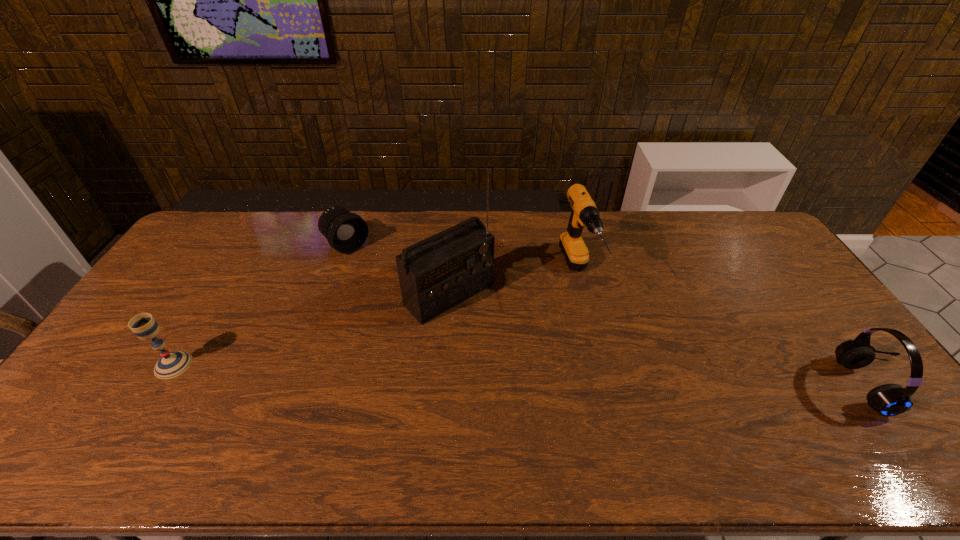
Where is `object located in the near edge section of the desktop`? This screenshot has height=540, width=960. object located in the near edge section of the desktop is located at coordinates (888, 400).

I want to click on object that is at the right edge, so click(x=888, y=400).

Where is `object present at the near right corner`? The height and width of the screenshot is (540, 960). object present at the near right corner is located at coordinates (888, 400).

Where is `free space at the far edge of the desktop`? Image resolution: width=960 pixels, height=540 pixels. free space at the far edge of the desktop is located at coordinates (516, 211).

Where is `vacant space at the near edge of the desktop`? This screenshot has height=540, width=960. vacant space at the near edge of the desktop is located at coordinates (607, 400).

Where is `free location at the left edge`? The height and width of the screenshot is (540, 960). free location at the left edge is located at coordinates (156, 302).

The height and width of the screenshot is (540, 960). What are the coordinates of `vacant space at the far right corner` in the screenshot? It's located at pyautogui.click(x=727, y=221).

Where is `vacant area that lies between the chalice and the shortest object`? The height and width of the screenshot is (540, 960). vacant area that lies between the chalice and the shortest object is located at coordinates (260, 305).

This screenshot has width=960, height=540. I want to click on free space between the second object from right to left and the tallest object, so [x=513, y=284].

Identify the location of vacant area between the fourth shortest object and the radio receiver. (513, 284).